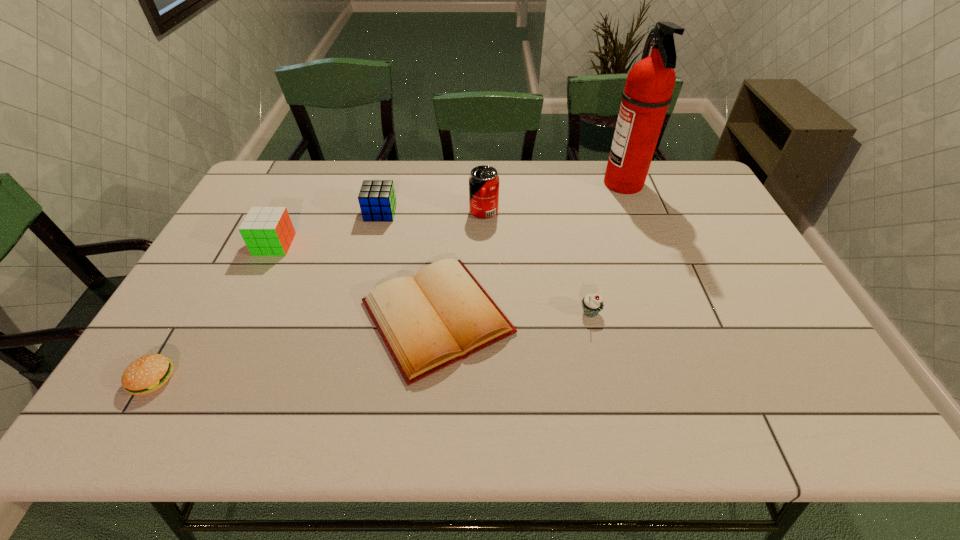
The width and height of the screenshot is (960, 540). In order to click on unoccupied position between the sixth object from right to left and the tallest object in this screenshot , I will do `click(449, 214)`.

This screenshot has height=540, width=960. What are the coordinates of `unoccupied position between the Bible and the sixth object from right to left` in the screenshot? It's located at (356, 281).

Image resolution: width=960 pixels, height=540 pixels. I want to click on free space between the Bible and the patty, so 295,348.

Where is `free space between the farther cube and the sixth shortest object`? Image resolution: width=960 pixels, height=540 pixels. free space between the farther cube and the sixth shortest object is located at coordinates (432, 212).

The width and height of the screenshot is (960, 540). Identify the location of empty space between the right cube and the left cube. (327, 228).

This screenshot has height=540, width=960. Find the location of `vacant area that lies between the cupcake and the farthest object`. vacant area that lies between the cupcake and the farthest object is located at coordinates (607, 248).

I want to click on vacant region between the leftmost object and the sixth shortest object, so click(319, 295).

The image size is (960, 540). In order to click on unoccupied area between the Bible and the right cube in this screenshot , I will do `click(409, 265)`.

Locate which object ranks fifth in proximity to the leftmost object. Please provide its 2D coordinates. Your answer should be formatted as a tuple, i.e. [(x, y)], where the tuple contains the x and y coordinates of a point satisfying the conditions above.

[(592, 304)]

You are a GUI agent. You are given a task and a screenshot of the screen. Output one action in this format:
    pyautogui.click(x=<x>, y=<y>)
    Task: Click on the second closest object to the cupcake
    The height and width of the screenshot is (540, 960).
    Given the screenshot: What is the action you would take?
    coord(484,181)